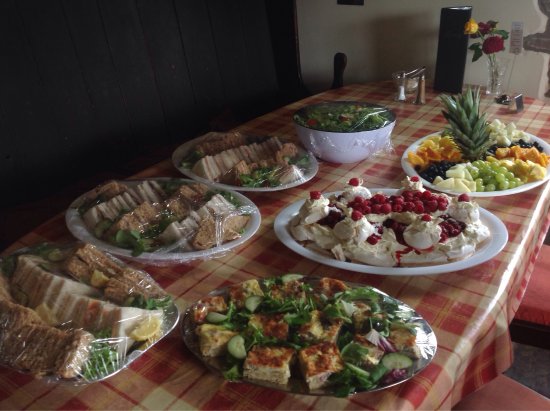
Locate an element on the screen. top bowl of food is located at coordinates (368, 124).